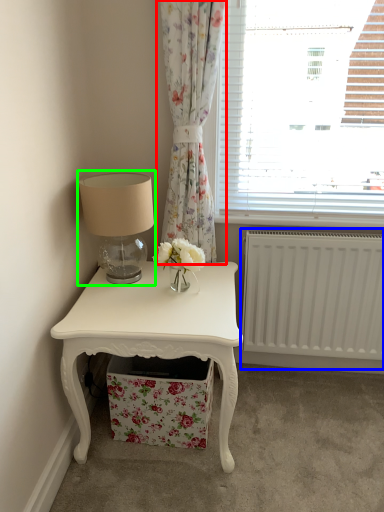
Question: Estimate the real-world distances between objects in this image. Which object is farther from curtain (highlighted by a red box), radiator (highlighted by a blue box) or table lamp (highlighted by a green box)?

Choices:
 (A) radiator
 (B) table lamp

Answer: (A)